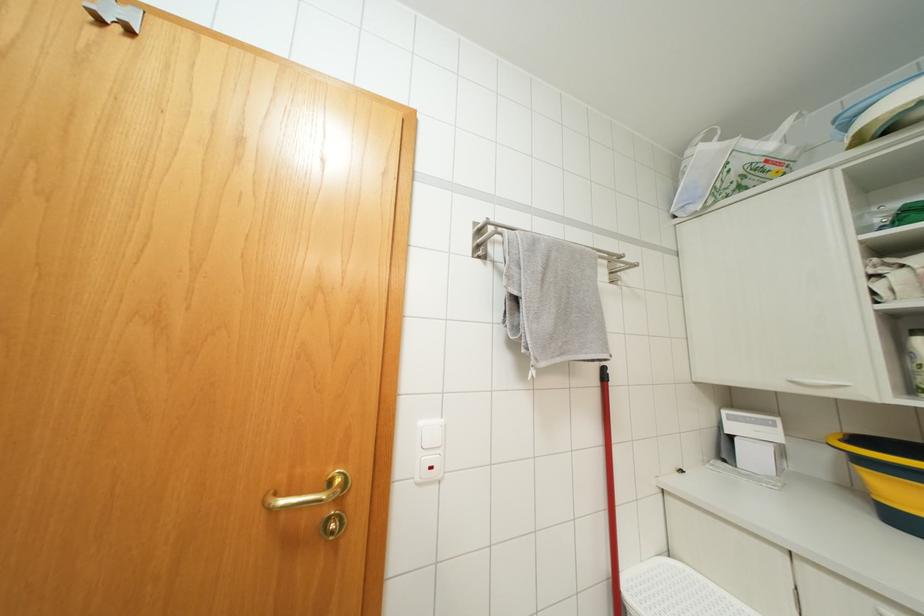
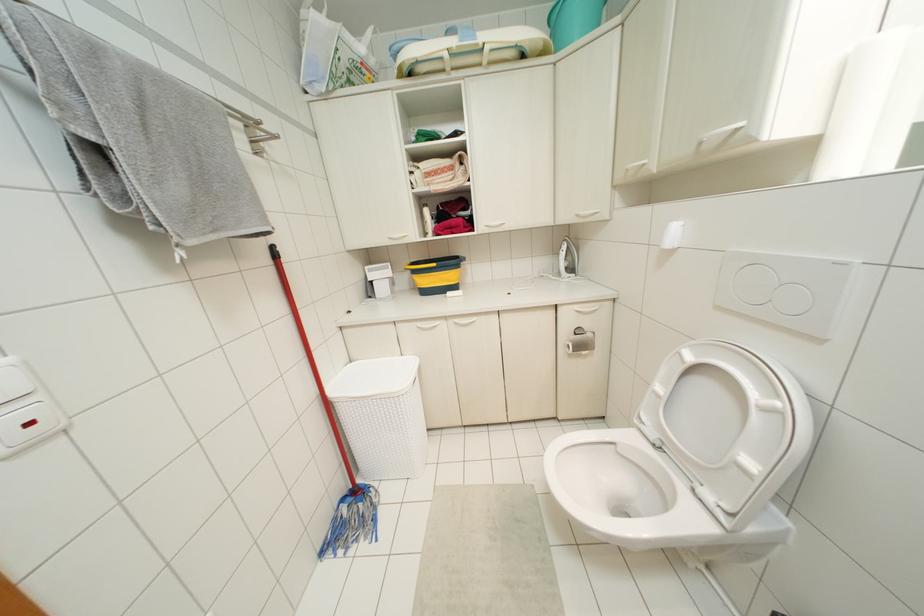
In the second image, find the point that corresponds to (441,421) in the first image.

(7, 360)